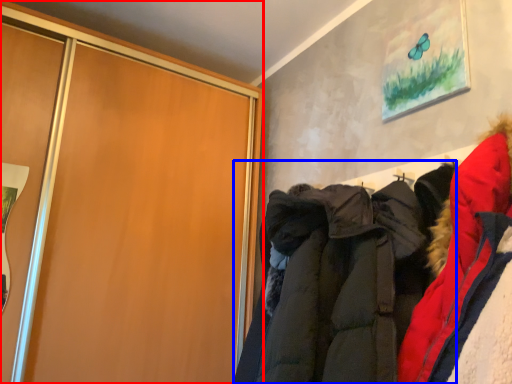
Question: Which object is closer to the camera taking this photo, cupboard (highlighted by a red box) or jacket (highlighted by a blue box)?

Choices:
 (A) cupboard
 (B) jacket

Answer: (B)